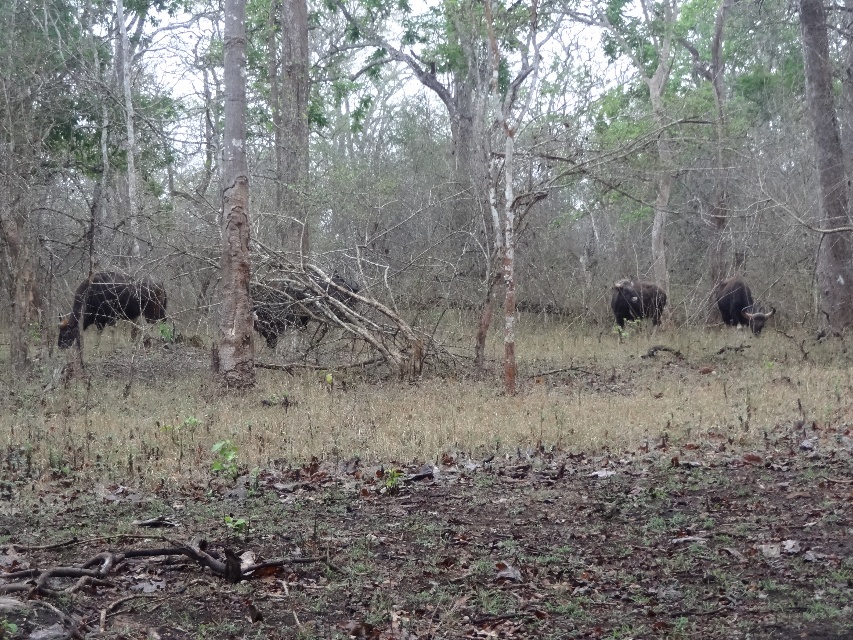
You are a wildlife photographer trying to capture a photo of both the black matte cow at center and the shiny black buffalo at center. Since you want to include both animals in the same frame, which animal should you focus on to ensure both fit in the photo?

The black matte cow at center has a lesser width compared to shiny black buffalo at center, so focusing on the shiny black buffalo at center will allow both animals to fit in the frame since it is wider and the cow is smaller in width.

You are a wildlife photographer aiming to capture a clear photo of both the black matte cow at center and the shiny black buffalo at center. Since you want both animals to be visible in the frame, which animal should you focus on first to ensure the other remains in the background?

You should focus on the black matte cow at center first because it is in front of the shiny black buffalo at center, so if you focus on the cow, the buffalo will naturally be in the background and still visible in the photo.